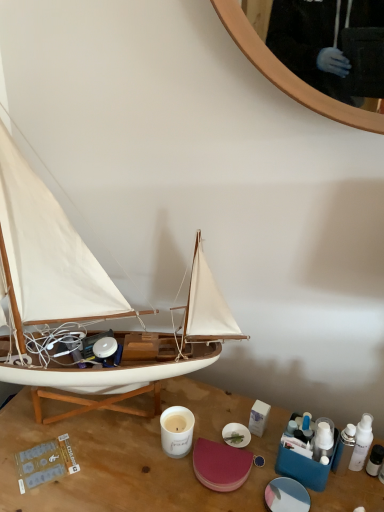
Question: Would you say wooden sailboat at left is to the left or to the right of wooden desk at center in the picture?

Choices:
 (A) left
 (B) right

Answer: (A)

Question: From the image's perspective, is wooden sailboat at left above or below wooden desk at center?

Choices:
 (A) above
 (B) below

Answer: (A)

Question: Relative to wooden desk at center, is wooden sailboat at left in front or behind?

Choices:
 (A) behind
 (B) front

Answer: (B)

Question: Considering the relative positions of wooden desk at center and wooden sailboat at left in the image provided, is wooden desk at center to the left or to the right of wooden sailboat at left?

Choices:
 (A) left
 (B) right

Answer: (B)

Question: In the image, is wooden desk at center positioned in front of or behind wooden sailboat at left?

Choices:
 (A) behind
 (B) front

Answer: (A)

Question: From a real-world perspective, is wooden desk at center above or below wooden sailboat at left?

Choices:
 (A) below
 (B) above

Answer: (A)

Question: Is wooden desk at center inside the boundaries of wooden sailboat at left, or outside?

Choices:
 (A) inside
 (B) outside

Answer: (B)